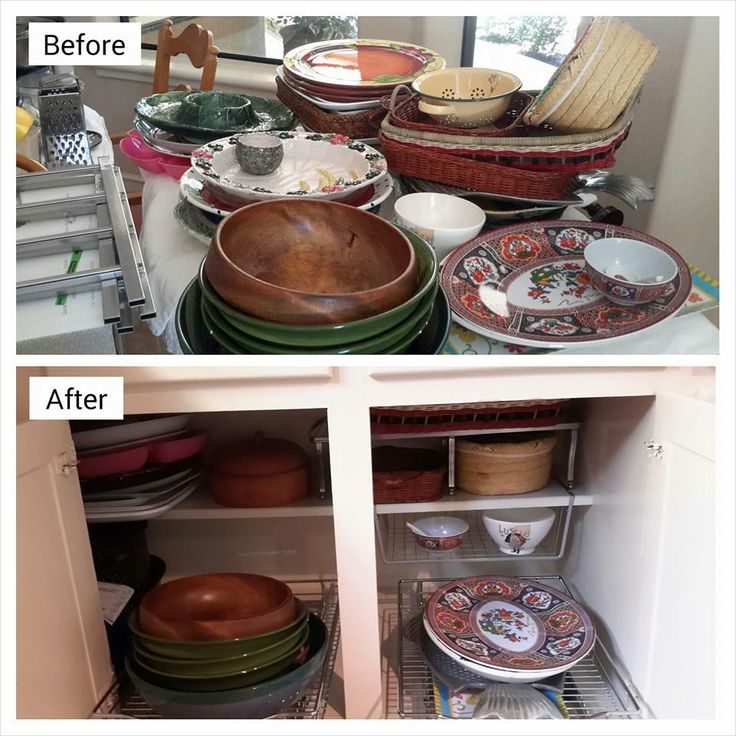
Find the location of a particular element. The height and width of the screenshot is (736, 736). chair is located at coordinates (191, 56).